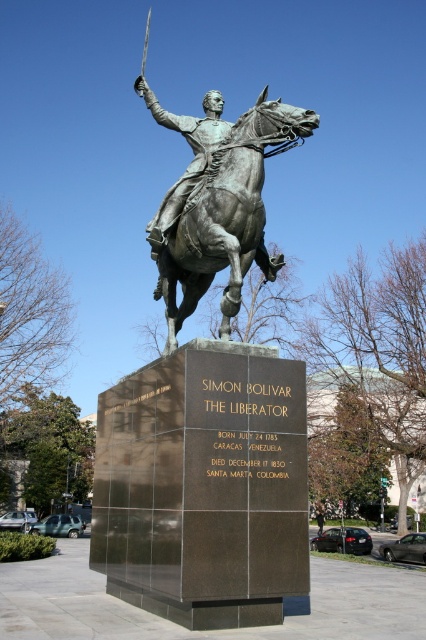
Question: Can you confirm if bronze statue at center is positioned above bronze/golden at center?

Choices:
 (A) no
 (B) yes

Answer: (A)

Question: Which of the following is the farthest from the observer?

Choices:
 (A) bronze/golden at center
 (B) bronze statue at center

Answer: (A)

Question: Among these objects, which one is farthest from the camera?

Choices:
 (A) bronze statue at center
 (B) bronze/golden at center

Answer: (B)

Question: Does bronze statue at center have a greater width compared to bronze/golden at center?

Choices:
 (A) no
 (B) yes

Answer: (A)

Question: Which point appears farthest from the camera in this image?

Choices:
 (A) (132, 376)
 (B) (204, 196)

Answer: (A)

Question: Does bronze statue at center have a greater width compared to bronze/golden at center?

Choices:
 (A) no
 (B) yes

Answer: (A)